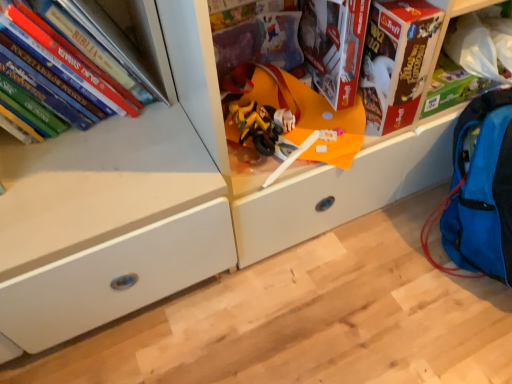
Question: Considering the relative positions of yellow matte motorcycle at center and cardboard box at upper right, which is the 1th shelf from back to front, in the image provided, is yellow matte motorcycle at center in front of cardboard box at upper right, which is the 1th shelf from back to front,?

Choices:
 (A) yes
 (B) no

Answer: (A)

Question: Does yellow matte motorcycle at center have a greater height compared to cardboard box at upper right, the 2th shelf positioned from the front?

Choices:
 (A) no
 (B) yes

Answer: (A)

Question: Is yellow matte motorcycle at center positioned behind cardboard box at upper right, which is the 1th shelf from back to front?

Choices:
 (A) no
 (B) yes

Answer: (A)

Question: Does yellow matte motorcycle at center appear on the left side of cardboard box at upper right, the 2th shelf positioned from the front?

Choices:
 (A) no
 (B) yes

Answer: (B)

Question: Can you confirm if yellow matte motorcycle at center is wider than cardboard box at upper right, the 2th shelf positioned from the front?

Choices:
 (A) yes
 (B) no

Answer: (B)

Question: Considering the positions of point (402, 46) and point (485, 226), is point (402, 46) closer or farther from the camera than point (485, 226)?

Choices:
 (A) closer
 (B) farther

Answer: (A)

Question: Considering the positions of red cardboard box at upper right and blue fabric backpack at lower right in the image, is red cardboard box at upper right wider or thinner than blue fabric backpack at lower right?

Choices:
 (A) thin
 (B) wide

Answer: (A)

Question: From the image's perspective, is red cardboard box at upper right positioned above or below blue fabric backpack at lower right?

Choices:
 (A) below
 (B) above

Answer: (B)

Question: Based on their sizes in the image, would you say red cardboard box at upper right is bigger or smaller than blue fabric backpack at lower right?

Choices:
 (A) small
 (B) big

Answer: (A)

Question: In terms of size, does white matte drawer at center, marked as the 1th shelf in a front-to-back arrangement, appear bigger or smaller than hardcover books at left?

Choices:
 (A) big
 (B) small

Answer: (A)

Question: From a real-world perspective, is white matte drawer at center, which is the second shelf in back-to-front order, positioned above or below hardcover books at left?

Choices:
 (A) above
 (B) below

Answer: (B)

Question: Is white matte drawer at center, marked as the 1th shelf in a front-to-back arrangement, wider or thinner than hardcover books at left?

Choices:
 (A) thin
 (B) wide

Answer: (B)

Question: Which is correct: white matte drawer at center, marked as the 1th shelf in a front-to-back arrangement, is inside hardcover books at left, or outside of it?

Choices:
 (A) inside
 (B) outside

Answer: (B)

Question: Based on their sizes in the image, would you say yellow matte motorcycle at center is bigger or smaller than blue fabric backpack at lower right?

Choices:
 (A) big
 (B) small

Answer: (B)

Question: In terms of height, does yellow matte motorcycle at center look taller or shorter compared to blue fabric backpack at lower right?

Choices:
 (A) tall
 (B) short

Answer: (B)